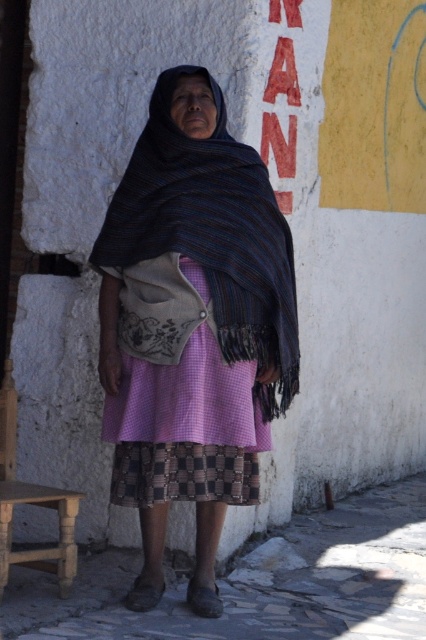
Who is higher up, pink checkered dress at center or wooden stool at lower left?

pink checkered dress at center is above.

Does pink checkered dress at center have a lesser width compared to wooden stool at lower left?

No, pink checkered dress at center is not thinner than wooden stool at lower left.

Is point (210, 490) less distant than point (8, 483)?

That is True.

This screenshot has width=426, height=640. In order to click on pink checkered dress at center in this screenshot , I will do `click(186, 428)`.

Does multicolored woven shawl at center lie in front of red painted sign at upper center?

Yes, it is.

Is multicolored woven shawl at center taller than red painted sign at upper center?

Correct, multicolored woven shawl at center is much taller as red painted sign at upper center.

What do you see at coordinates (192, 324) in the screenshot?
I see `multicolored woven shawl at center` at bounding box center [192, 324].

Identify the location of multicolored woven shawl at center. (192, 324).

Can you confirm if multicolored woven shawl at center is bigger than wooden stool at lower left?

Yes.

Does multicolored woven shawl at center come in front of wooden stool at lower left?

No, multicolored woven shawl at center is further to the viewer.

Does point (233, 269) lie behind point (49, 490)?

No, (233, 269) is closer to viewer.

Identify the location of multicolored woven shawl at center. This screenshot has height=640, width=426. (192, 324).